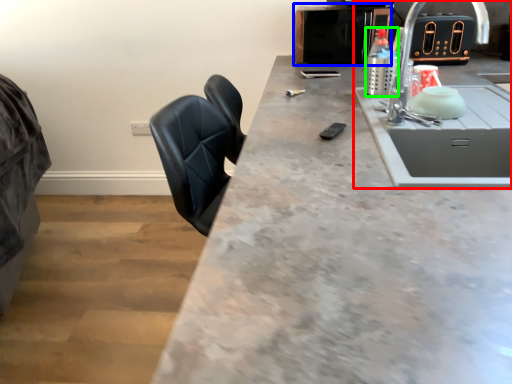
Question: Based on their relative distances, which object is nearer to sink (highlighted by a red box)? Choose from appliance (highlighted by a blue box) and bottle (highlighted by a green box).

Choices:
 (A) appliance
 (B) bottle

Answer: (B)